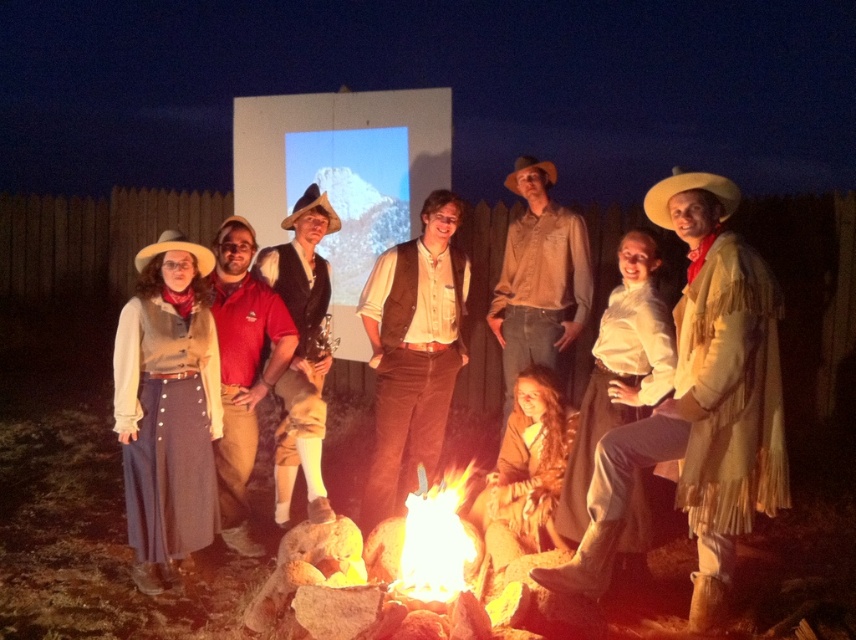
Which of these two, light brown leather shirt at center or flaming wood at center, stands taller?

light brown leather shirt at center is taller.

Is light brown leather shirt at center shorter than flaming wood at center?

Incorrect, light brown leather shirt at center's height does not fall short of flaming wood at center's.

You are a GUI agent. You are given a task and a screenshot of the screen. Output one action in this format:
    pyautogui.click(x=<x>, y=<y>)
    Task: Click on the light brown leather shirt at center
    This screenshot has height=640, width=856.
    Given the screenshot: What is the action you would take?
    pyautogui.click(x=539, y=276)

Is white cotton blouse at center positioned in front of light brown straw cowboy hat at right?

No, white cotton blouse at center is behind light brown straw cowboy hat at right.

Image resolution: width=856 pixels, height=640 pixels. What do you see at coordinates (619, 380) in the screenshot? I see `white cotton blouse at center` at bounding box center [619, 380].

Where is `white cotton blouse at center`? This screenshot has height=640, width=856. white cotton blouse at center is located at coordinates (619, 380).

Is white cotton blouse at center to the left of light brown felt cowboy hat at left from the viewer's perspective?

Incorrect, white cotton blouse at center is not on the left side of light brown felt cowboy hat at left.

Does white cotton blouse at center have a smaller size compared to light brown felt cowboy hat at left?

No.

Between point (638, 342) and point (182, 241), which one is positioned behind?

Positioned behind is point (182, 241).

The height and width of the screenshot is (640, 856). What are the coordinates of `white cotton blouse at center` in the screenshot? It's located at (619, 380).